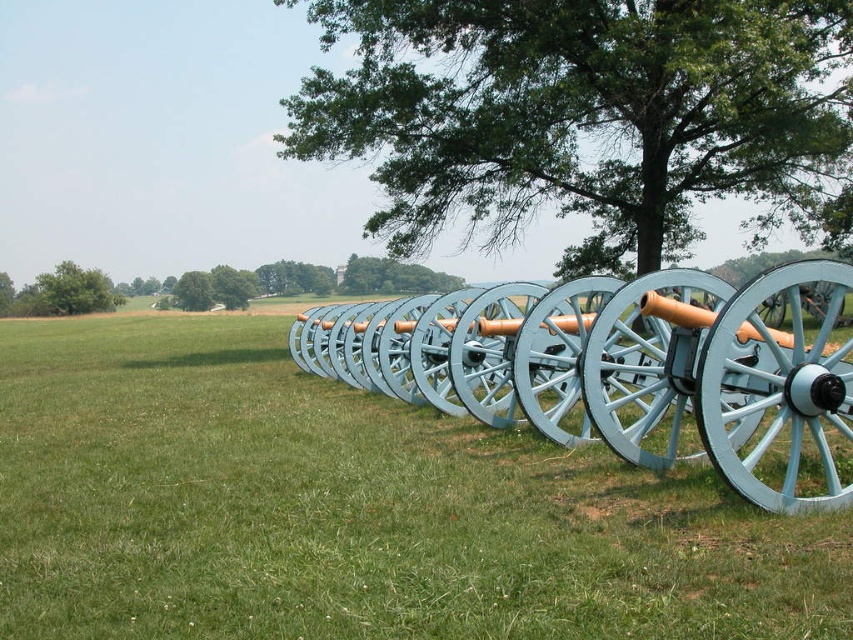
You are a photographer wanting to capture the light blue wood cannon at center and the green leafy tree at upper left in a single frame. Which object will appear taller in the photo?

The green leafy tree at upper left will appear taller in the photo because the light blue wood cannon at center has a lesser height compared to it.

You are a park ranger inspecting the cannons. You notice two cannons in the center area labeled as light blue wood cannon at center and light blue wooden cannon at center. Which cannon is shorter?

The light blue wood cannon at center is shorter than the light blue wooden cannon at center.